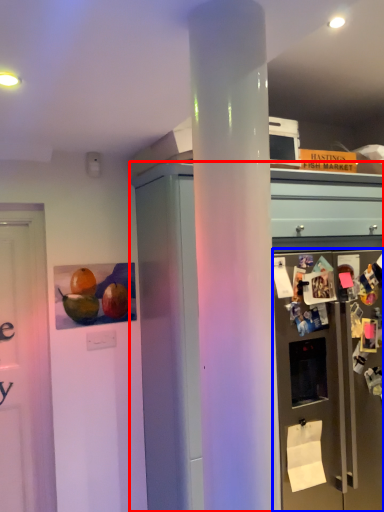
Question: Which of the following is the closest to the observer, cabinetry (highlighted by a red box) or refrigerator (highlighted by a blue box)?

Choices:
 (A) cabinetry
 (B) refrigerator

Answer: (A)